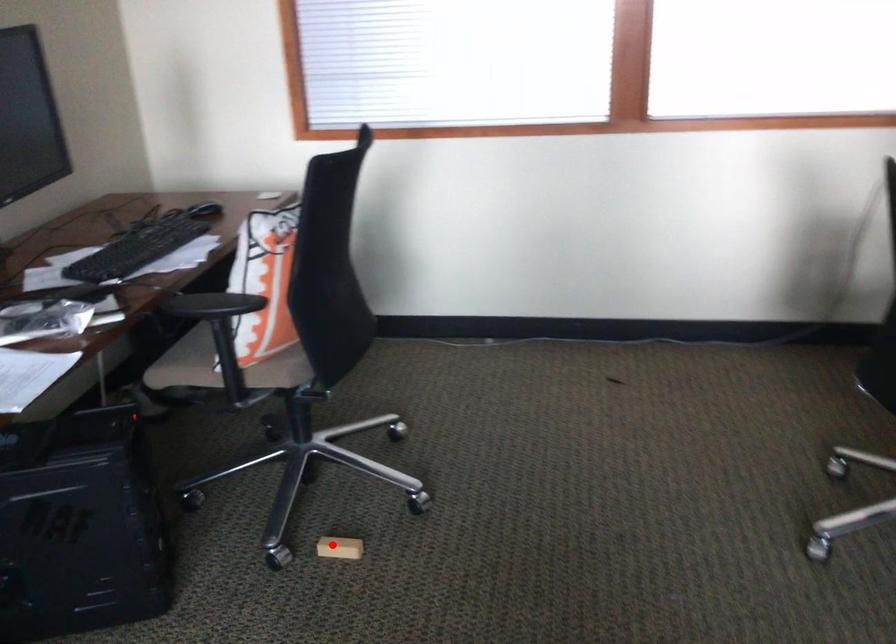
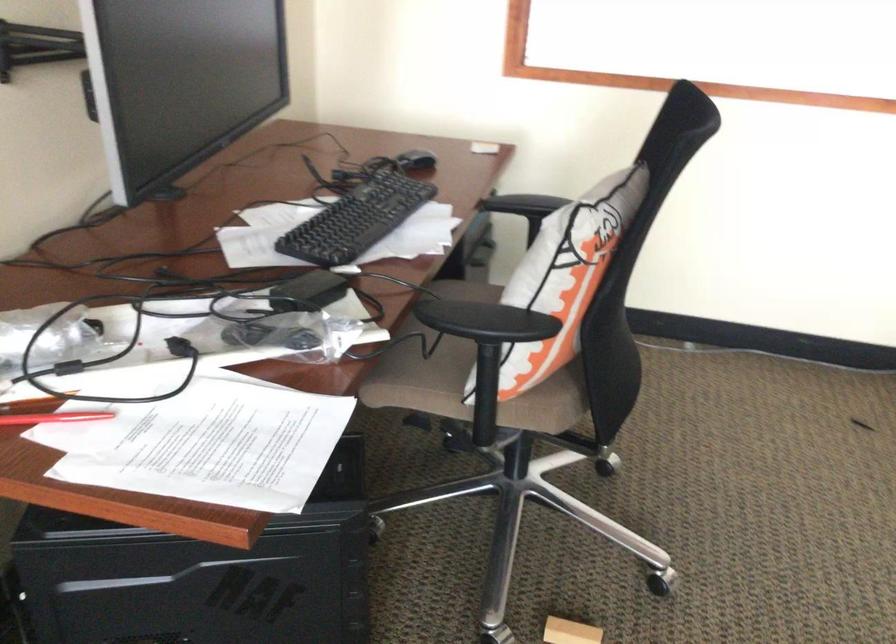
Locate, in the second image, the point that corresponds to the highlighted location in the first image.

(570, 632)